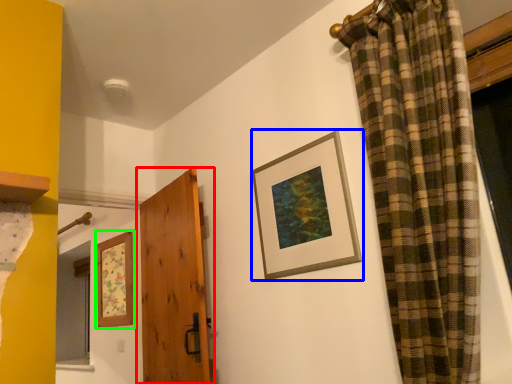
Question: Based on their relative distances, which object is farther from door (highlighted by a red box)? Choose from picture frame (highlighted by a blue box) and picture frame (highlighted by a green box).

Choices:
 (A) picture frame
 (B) picture frame

Answer: (A)